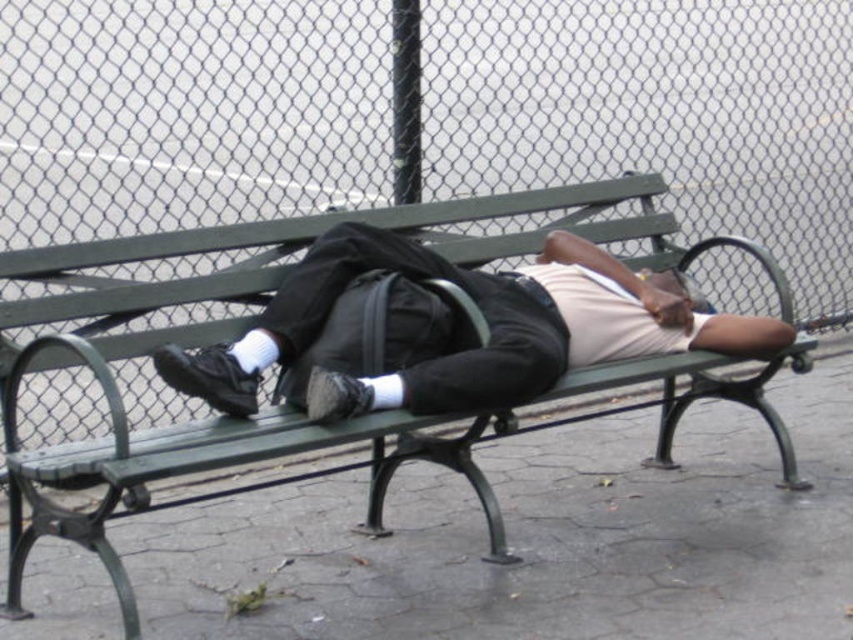
Question: Is wire mesh fence at upper center bigger than black matte backpack at center?

Choices:
 (A) no
 (B) yes

Answer: (B)

Question: Which object is closer to the camera taking this photo?

Choices:
 (A) green wood park bench at center
 (B) wire mesh fence at upper center
 (C) black matte backpack at center

Answer: (A)

Question: Which object is closer to the camera taking this photo?

Choices:
 (A) wire mesh fence at upper center
 (B) green wood park bench at center

Answer: (B)

Question: Does wire mesh fence at upper center appear over black matte backpack at center?

Choices:
 (A) yes
 (B) no

Answer: (A)

Question: Which point is closer to the camera taking this photo?

Choices:
 (A) click(312, 33)
 (B) click(36, 276)
 (C) click(398, 250)

Answer: (B)

Question: Is the position of wire mesh fence at upper center more distant than that of green wood park bench at center?

Choices:
 (A) yes
 (B) no

Answer: (A)